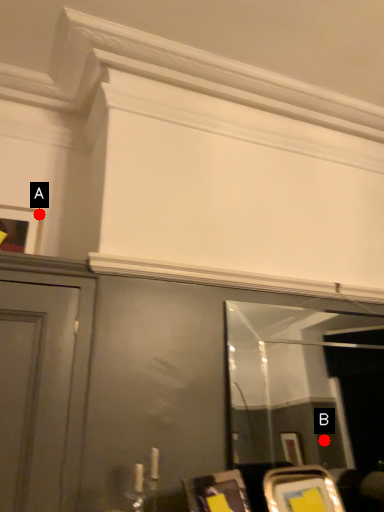
Question: Two points are circled on the image, labeled by A and B beside each circle. Among these points, which one is nearest to the camera?

Choices:
 (A) A is closer
 (B) B is closer

Answer: (A)